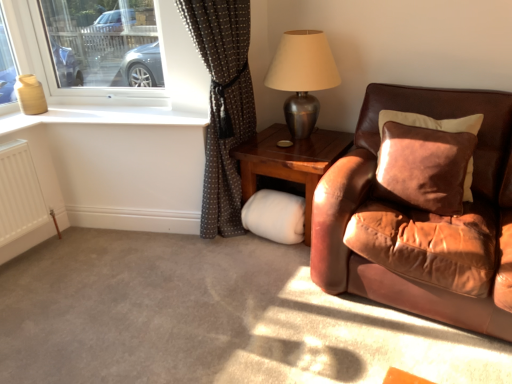
Question: Considering the relative sizes of white glossy window sill at upper left and clear glass window at upper left in the image provided, is white glossy window sill at upper left wider than clear glass window at upper left?

Choices:
 (A) yes
 (B) no

Answer: (A)

Question: Is white glossy window sill at upper left bigger than clear glass window at upper left?

Choices:
 (A) no
 (B) yes

Answer: (A)

Question: Is white glossy window sill at upper left shorter than clear glass window at upper left?

Choices:
 (A) no
 (B) yes

Answer: (B)

Question: Would you say clear glass window at upper left is part of white glossy window sill at upper left's contents?

Choices:
 (A) yes
 (B) no

Answer: (B)

Question: Does white glossy window sill at upper left turn towards clear glass window at upper left?

Choices:
 (A) no
 (B) yes

Answer: (A)

Question: Considering the positions of brown dotted fabric at left and white glossy window sill at upper left in the image, is brown dotted fabric at left bigger or smaller than white glossy window sill at upper left?

Choices:
 (A) big
 (B) small

Answer: (A)

Question: In the image, is brown dotted fabric at left on the left side or the right side of white glossy window sill at upper left?

Choices:
 (A) right
 (B) left

Answer: (A)

Question: From a real-world perspective, is brown dotted fabric at left physically located above or below white glossy window sill at upper left?

Choices:
 (A) below
 (B) above

Answer: (A)

Question: From the image's perspective, is brown dotted fabric at left above or below white glossy window sill at upper left?

Choices:
 (A) above
 (B) below

Answer: (B)

Question: From the image's perspective, is wooden side table at right located above or below white matte radiator at lower left?

Choices:
 (A) above
 (B) below

Answer: (A)

Question: Choose the correct answer: Is wooden side table at right inside white matte radiator at lower left or outside it?

Choices:
 (A) inside
 (B) outside

Answer: (B)

Question: From their relative heights in the image, would you say wooden side table at right is taller or shorter than white matte radiator at lower left?

Choices:
 (A) tall
 (B) short

Answer: (B)

Question: Considering their positions, is wooden side table at right located in front of or behind white matte radiator at lower left?

Choices:
 (A) front
 (B) behind

Answer: (B)

Question: Is wooden side table at right wider or thinner than metallic silver table lamp at upper right?

Choices:
 (A) thin
 (B) wide

Answer: (B)

Question: Considering the positions of wooden side table at right and metallic silver table lamp at upper right in the image, is wooden side table at right bigger or smaller than metallic silver table lamp at upper right?

Choices:
 (A) small
 (B) big

Answer: (B)